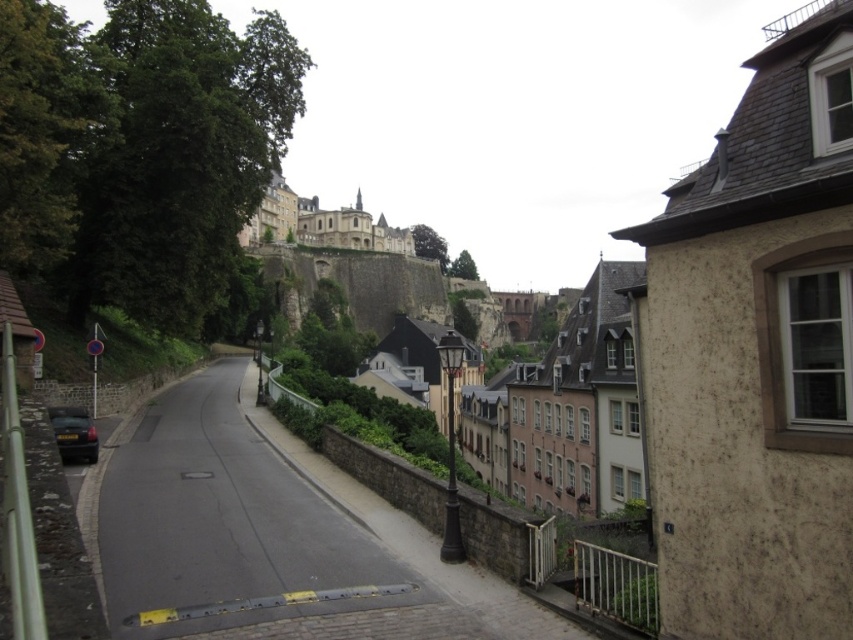
Question: Is brown rough stone wall at right to the right of metallic gray car at lower left from the viewer's perspective?

Choices:
 (A) no
 (B) yes

Answer: (B)

Question: Does brown rough stone wall at right have a lesser width compared to metallic gray car at lower left?

Choices:
 (A) yes
 (B) no

Answer: (B)

Question: Which object is farther from the camera taking this photo?

Choices:
 (A) brown rough stone wall at right
 (B) metallic gray car at lower left

Answer: (B)

Question: Which object is closer to the camera taking this photo?

Choices:
 (A) metallic gray car at lower left
 (B) brown rough stone wall at right

Answer: (B)

Question: Where is brown rough stone wall at right located in relation to metallic gray car at lower left in the image?

Choices:
 (A) left
 (B) right

Answer: (B)